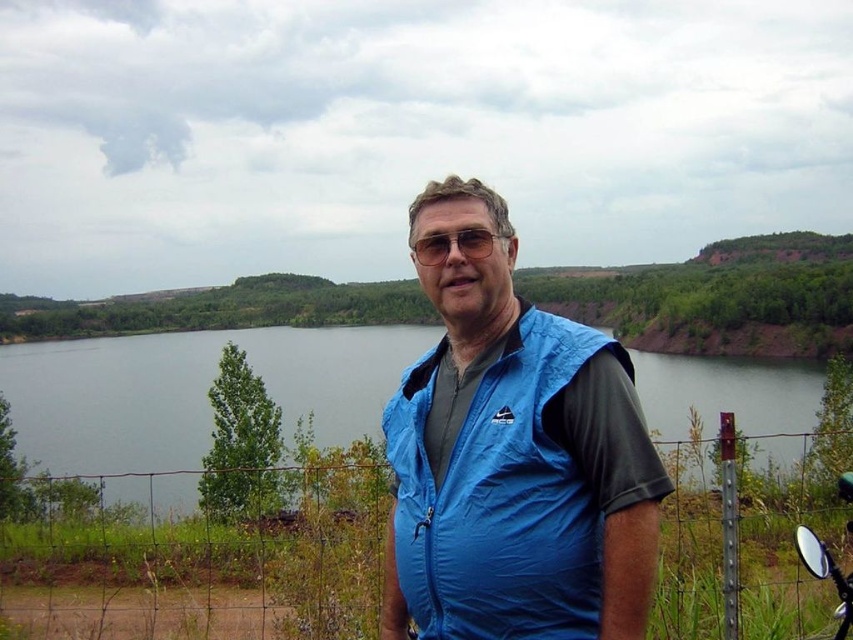
Question: Estimate the real-world distances between objects in this image. Which object is farther from the blue water at center?

Choices:
 (A) blue fabric vest at center
 (B) clear plastic goggles at center

Answer: (A)

Question: Which point is farther to the camera?

Choices:
 (A) (485, 253)
 (B) (630, 481)
 (C) (392, 368)

Answer: (C)

Question: Is blue fabric vest at center below blue water at center?

Choices:
 (A) yes
 (B) no

Answer: (B)

Question: Is blue water at center thinner than clear plastic goggles at center?

Choices:
 (A) no
 (B) yes

Answer: (A)

Question: Is blue fabric vest at center to the right of blue water at center from the viewer's perspective?

Choices:
 (A) no
 (B) yes

Answer: (B)

Question: Which object appears closest to the camera in this image?

Choices:
 (A) blue fabric vest at center
 (B) clear plastic goggles at center
 (C) blue water at center

Answer: (A)